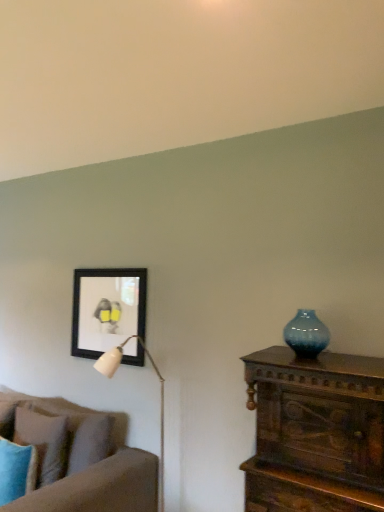
This screenshot has width=384, height=512. Describe the element at coordinates (92, 465) in the screenshot. I see `soft brown fabric couch at left` at that location.

Find the location of `black matte picture frame at upper left`. black matte picture frame at upper left is located at coordinates (106, 309).

What is the approximate height of blue glass vase at right?

blue glass vase at right is 10.72 inches in height.

Measure the distance between textured brown pillow at lower left, which appears as the second pillow when viewed from the front, and camera.

textured brown pillow at lower left, which appears as the second pillow when viewed from the front, is 8.34 feet away from camera.

I want to click on white glossy table lamp at upper left, so click(x=161, y=395).

Is blue glass vase at right facing away from matte blue pillow at lower left, which is the 1th pillow from front to back?

blue glass vase at right is not turned away from matte blue pillow at lower left, which is the 1th pillow from front to back.

Is blue glass vase at right taller than matte blue pillow at lower left, which is the 1th pillow from front to back?

In fact, blue glass vase at right may be shorter than matte blue pillow at lower left, which is the 1th pillow from front to back.

Between blue glass vase at right and matte blue pillow at lower left, marked as the second pillow in a back-to-front arrangement, which one appears on the left side from the viewer's perspective?

matte blue pillow at lower left, marked as the second pillow in a back-to-front arrangement, is more to the left.

Between blue glass vase at right and matte blue pillow at lower left, which is the 1th pillow from front to back, which one has larger width?

matte blue pillow at lower left, which is the 1th pillow from front to back.

Between blue glass vase at right and white glossy table lamp at upper left, which one appears on the right side from the viewer's perspective?

blue glass vase at right is more to the right.

Where is `vase located above the white glossy table lamp at upper left (from a real-world perspective)`? The width and height of the screenshot is (384, 512). vase located above the white glossy table lamp at upper left (from a real-world perspective) is located at coordinates (306, 334).

How different are the orientations of blue glass vase at right and white glossy table lamp at upper left in degrees?

There is a 2.63-degree angle between the facing directions of blue glass vase at right and white glossy table lamp at upper left.

Does blue glass vase at right come behind white glossy table lamp at upper left?

Yes.

Between point (304, 311) and point (79, 459), which one is positioned in front?

Positioned in front is point (304, 311).

Is the depth of blue glass vase at right less than that of soft brown fabric couch at left?

No, blue glass vase at right is behind soft brown fabric couch at left.

From the image's perspective, which object appears higher, blue glass vase at right or soft brown fabric couch at left?

blue glass vase at right.

From a real-world perspective, is matte blue pillow at lower left, which is the 1th pillow from front to back, physically located above or below black matte picture frame at upper left?

In terms of real-world spatial position, matte blue pillow at lower left, which is the 1th pillow from front to back, is below black matte picture frame at upper left.

Are matte blue pillow at lower left, which is the 1th pillow from front to back, and black matte picture frame at upper left far apart?

That's not correct — matte blue pillow at lower left, which is the 1th pillow from front to back, is a little close to black matte picture frame at upper left.

Relative to black matte picture frame at upper left, is matte blue pillow at lower left, which is the 1th pillow from front to back, in front or behind?

Visually, matte blue pillow at lower left, which is the 1th pillow from front to back, is located in front of black matte picture frame at upper left.

In the scene shown: Between white glossy table lamp at upper left and textured brown pillow at lower left, which appears as the second pillow when viewed from the front, which one has larger size?

white glossy table lamp at upper left.

In terms of width, does white glossy table lamp at upper left look wider or thinner when compared to textured brown pillow at lower left, which appears as the second pillow when viewed from the front?

white glossy table lamp at upper left is wider than textured brown pillow at lower left, which appears as the second pillow when viewed from the front.

From the picture: From the image's perspective, which is above, white glossy table lamp at upper left or textured brown pillow at lower left, marked as the first pillow in a back-to-front arrangement?

white glossy table lamp at upper left is shown above in the image.

Can you confirm if black matte picture frame at upper left is smaller than white glossy table lamp at upper left?

Yes, black matte picture frame at upper left is smaller than white glossy table lamp at upper left.

Does black matte picture frame at upper left have a greater width compared to white glossy table lamp at upper left?

Incorrect, the width of black matte picture frame at upper left does not surpass that of white glossy table lamp at upper left.

From the image's perspective, who appears lower, black matte picture frame at upper left or white glossy table lamp at upper left?

white glossy table lamp at upper left.

In the image, is white glossy table lamp at upper left positioned in front of or behind soft brown fabric couch at left?

white glossy table lamp at upper left is behind soft brown fabric couch at left.

Considering the relative sizes of white glossy table lamp at upper left and soft brown fabric couch at left in the image provided, is white glossy table lamp at upper left wider than soft brown fabric couch at left?

Incorrect, the width of white glossy table lamp at upper left does not surpass that of soft brown fabric couch at left.

Could you tell me if white glossy table lamp at upper left is turned towards soft brown fabric couch at left?

No, white glossy table lamp at upper left is not facing towards soft brown fabric couch at left.

Can you confirm if white glossy table lamp at upper left is taller than soft brown fabric couch at left?

Yes.

The width and height of the screenshot is (384, 512). I want to click on vase in front of the matte blue pillow at lower left, which is the 1th pillow from front to back, so click(x=306, y=334).

Locate an element on the screen. Image resolution: width=384 pixels, height=512 pixels. vase on the right of white glossy table lamp at upper left is located at coordinates (306, 334).

Considering their positions, is white glossy table lamp at upper left positioned further to black matte picture frame at upper left than blue glass vase at right?

Among the two, blue glass vase at right is located further to black matte picture frame at upper left.

Looking at the image, which one is located closer to blue glass vase at right, textured brown pillow at lower left, marked as the first pillow in a back-to-front arrangement, or soft brown fabric couch at left?

soft brown fabric couch at left is closer to blue glass vase at right.

Considering their positions, is matte blue pillow at lower left, marked as the second pillow in a back-to-front arrangement, positioned further to black matte picture frame at upper left than textured brown pillow at lower left, which appears as the second pillow when viewed from the front?

The object further to black matte picture frame at upper left is matte blue pillow at lower left, marked as the second pillow in a back-to-front arrangement.

Based on their spatial positions, is soft brown fabric couch at left or white glossy table lamp at upper left further from matte blue pillow at lower left, marked as the second pillow in a back-to-front arrangement?

white glossy table lamp at upper left is positioned further to the anchor matte blue pillow at lower left, marked as the second pillow in a back-to-front arrangement.

Looking at the image, which one is located closer to soft brown fabric couch at left, textured brown pillow at lower left, which appears as the second pillow when viewed from the front, or white glossy table lamp at upper left?

textured brown pillow at lower left, which appears as the second pillow when viewed from the front.

Considering their positions, is blue glass vase at right positioned closer to soft brown fabric couch at left than textured brown pillow at lower left, marked as the first pillow in a back-to-front arrangement?

textured brown pillow at lower left, marked as the first pillow in a back-to-front arrangement.

From the image, which object appears to be nearer to white glossy table lamp at upper left, blue glass vase at right or black matte picture frame at upper left?

Among the two, black matte picture frame at upper left is located nearer to white glossy table lamp at upper left.

Looking at the image, which one is located further to black matte picture frame at upper left, blue glass vase at right or textured brown pillow at lower left, marked as the first pillow in a back-to-front arrangement?

blue glass vase at right lies further to black matte picture frame at upper left than the other object.

Find the location of `table lamp between soft brown fabric couch at left and blue glass vase at right in the horizontal direction`. table lamp between soft brown fabric couch at left and blue glass vase at right in the horizontal direction is located at coordinates (161, 395).

You are a GUI agent. You are given a task and a screenshot of the screen. Output one action in this format:
    pyautogui.click(x=<x>, y=<y>)
    Task: Click on the table lamp between black matte picture frame at upper left and textured brown pillow at lower left, which appears as the second pillow when viewed from the front, vertically
    The image size is (384, 512).
    Given the screenshot: What is the action you would take?
    pyautogui.click(x=161, y=395)

Find the location of a particular element. pillow positioned between soft brown fabric couch at left and textured brown pillow at lower left, marked as the first pillow in a back-to-front arrangement, from near to far is located at coordinates (16, 470).

Identify the location of table lamp between textured brown pillow at lower left, which appears as the second pillow when viewed from the front, and blue glass vase at right, in the horizontal direction. (161, 395).